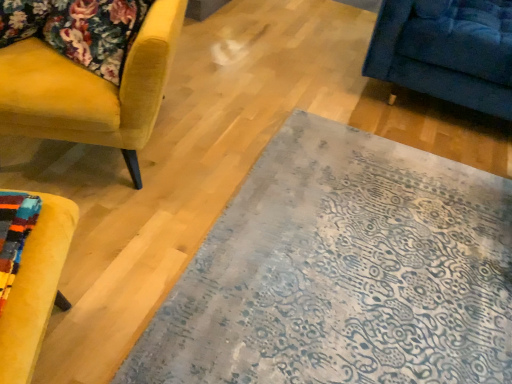
Question: Is velvet yellow armchair at left oriented towards blue-patterned rug at center?

Choices:
 (A) yes
 (B) no

Answer: (B)

Question: Is velvet yellow armchair at left positioned with its back to blue-patterned rug at center?

Choices:
 (A) yes
 (B) no

Answer: (B)

Question: Does velvet yellow armchair at left appear on the right side of blue-patterned rug at center?

Choices:
 (A) no
 (B) yes

Answer: (A)

Question: Is velvet yellow armchair at left taller than blue-patterned rug at center?

Choices:
 (A) no
 (B) yes

Answer: (B)

Question: Does velvet yellow armchair at left have a smaller size compared to blue-patterned rug at center?

Choices:
 (A) yes
 (B) no

Answer: (B)

Question: From a real-world perspective, is velvet yellow armchair at left physically located above or below velvet floral cushion at upper left?

Choices:
 (A) above
 (B) below

Answer: (B)

Question: In terms of height, does velvet yellow armchair at left look taller or shorter compared to velvet floral cushion at upper left?

Choices:
 (A) tall
 (B) short

Answer: (A)

Question: In terms of width, does velvet yellow armchair at left look wider or thinner when compared to velvet floral cushion at upper left?

Choices:
 (A) thin
 (B) wide

Answer: (B)

Question: Would you say velvet yellow armchair at left is inside or outside velvet floral cushion at upper left?

Choices:
 (A) outside
 (B) inside

Answer: (A)

Question: Does point (62, 36) appear closer or farther from the camera than point (434, 337)?

Choices:
 (A) farther
 (B) closer

Answer: (A)

Question: Looking at their shapes, would you say velvet floral cushion at upper left is wider or thinner than blue-patterned rug at center?

Choices:
 (A) wide
 (B) thin

Answer: (B)

Question: From their relative heights in the image, would you say velvet floral cushion at upper left is taller or shorter than blue-patterned rug at center?

Choices:
 (A) short
 (B) tall

Answer: (B)

Question: From a real-world perspective, is velvet floral cushion at upper left positioned above or below blue-patterned rug at center?

Choices:
 (A) below
 (B) above

Answer: (B)

Question: In terms of size, does blue-patterned rug at center appear bigger or smaller than velvet yellow armchair at left?

Choices:
 (A) big
 (B) small

Answer: (B)

Question: Is blue-patterned rug at center inside the boundaries of velvet yellow armchair at left, or outside?

Choices:
 (A) inside
 (B) outside

Answer: (B)